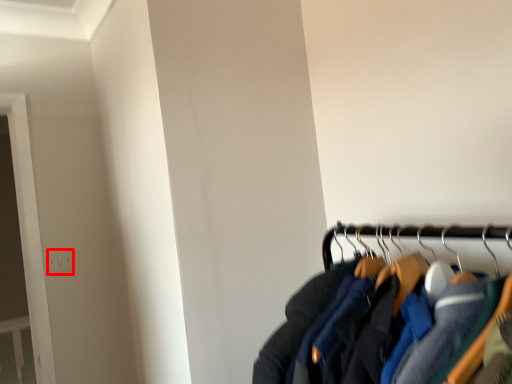
Question: From the image's perspective, considering the relative positions of electric outlet (annotated by the red box) and jacket in the image provided, where is electric outlet (annotated by the red box) located with respect to the staircase?

Choices:
 (A) below
 (B) above

Answer: (A)